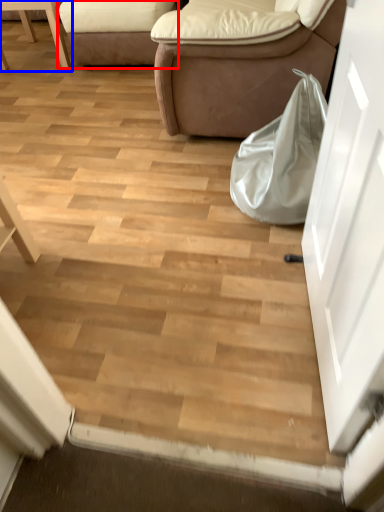
Question: Which object appears closest to the camera in this image, studio couch (highlighted by a red box) or furniture (highlighted by a blue box)?

Choices:
 (A) studio couch
 (B) furniture

Answer: (A)